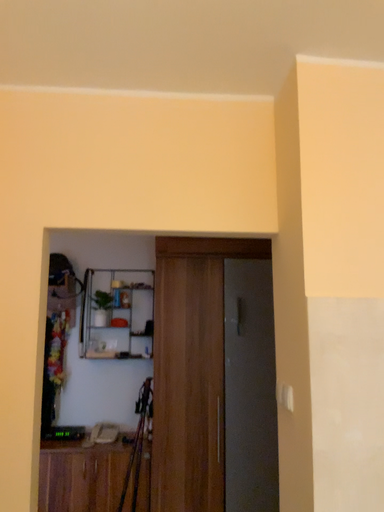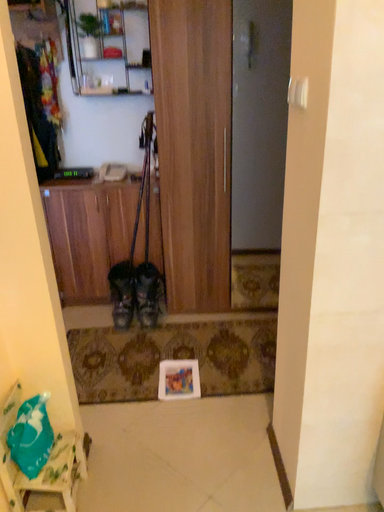
Question: How did the camera likely rotate when shooting the video?

Choices:
 (A) rotated upward
 (B) rotated downward

Answer: (B)